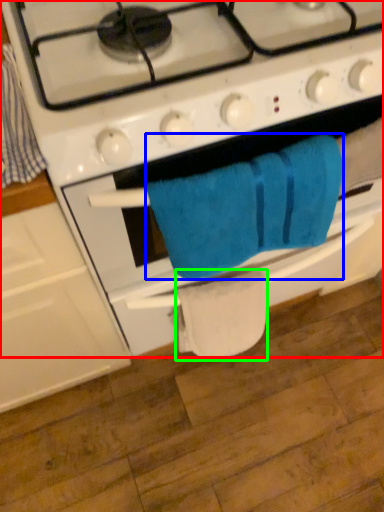
Question: Which is nearer to the gas stove (highlighted by a red box)? towel/napkin (highlighted by a blue box) or toilet paper (highlighted by a green box).

Choices:
 (A) towel/napkin
 (B) toilet paper

Answer: (A)